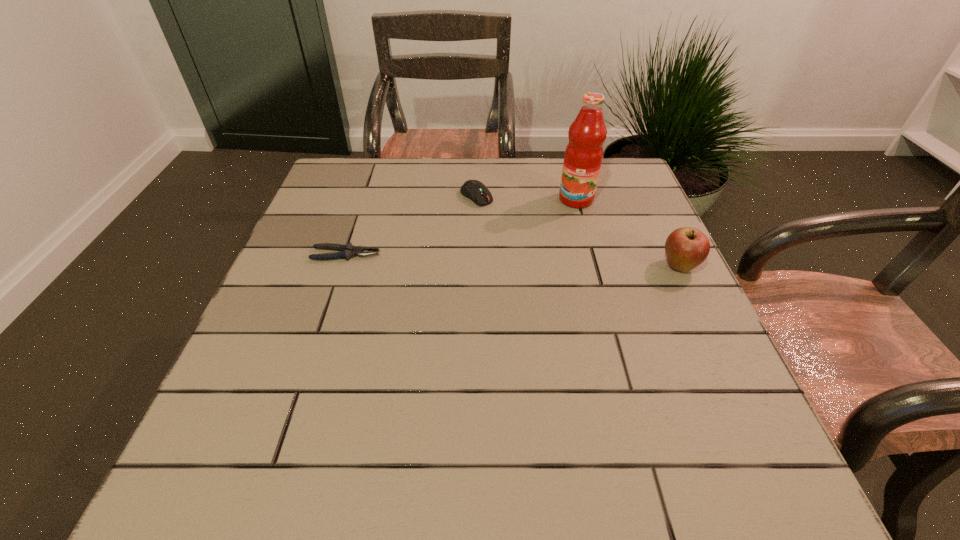
The height and width of the screenshot is (540, 960). I want to click on fruit juice present at the right edge, so click(583, 156).

In order to click on object positioned at the far right corner in this screenshot , I will do `click(583, 156)`.

Image resolution: width=960 pixels, height=540 pixels. Identify the location of free space at the far edge of the desktop. (455, 184).

The width and height of the screenshot is (960, 540). In order to click on free space at the near edge in this screenshot , I will do `click(346, 428)`.

The image size is (960, 540). In the image, there is a desktop. Identify the location of vacant space at the left edge. (317, 340).

In the image, there is a desktop. Where is `vacant space at the right edge`? The width and height of the screenshot is (960, 540). vacant space at the right edge is located at coordinates (654, 256).

Find the location of a particular element. vacant space at the far left corner of the desktop is located at coordinates (376, 159).

You are a GUI agent. You are given a task and a screenshot of the screen. Output one action in this format:
    pyautogui.click(x=<x>, y=<y>)
    Task: Click on the free space at the near left corner
    
    Given the screenshot: What is the action you would take?
    pyautogui.click(x=227, y=423)

The width and height of the screenshot is (960, 540). Find the location of `blank space at the far right corner`. blank space at the far right corner is located at coordinates (611, 176).

Identify the location of free location at the near right corner of the desktop. coord(730,415).